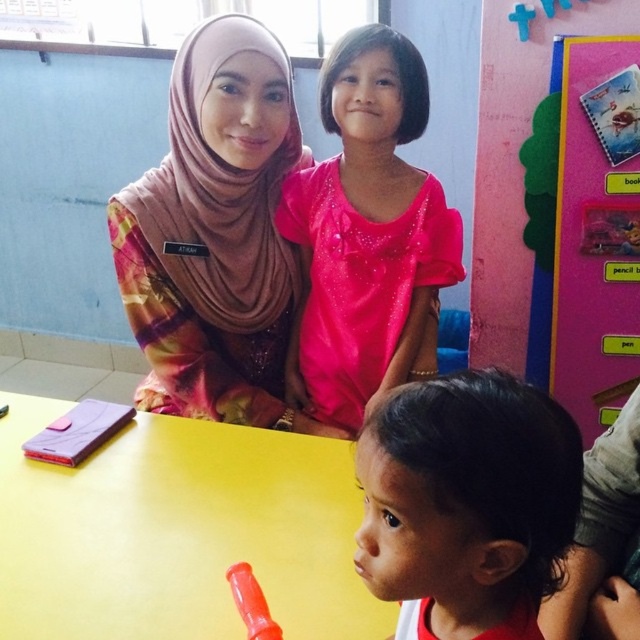
You are a photographer setting up a shot of the scene described. You want to focus on the multicolored fabric hijab at upper left and the dark brown hair at lower right. Which object is closer to your camera?

The multicolored fabric hijab at upper left is closer to the camera than the dark brown hair at lower right.

You are a photographer setting up for a group photo. You want to ensure that both the multicolored fabric hijab at upper left and the child holding the red object are in focus. Given that your camera has a depth of field that can cover 4 feet, will you be able to capture both subjects clearly?

The distance between the multicolored fabric hijab at upper left and the child holding the red object is 4.54 feet. Since the camera can only cover 4 feet, the depth of field is insufficient to keep both in focus simultaneously.

You are a photographer setting up for a group photo in the scene. You need to ensure that the multicolored fabric hijab at upper left is visible in the frame. Where should you position the camera relative to the hijab?

To ensure the multicolored fabric hijab at upper left is visible in the frame, position the camera so it is facing towards the hijab, keeping it within the camera view. The exact coordinates at point (214,232) indicate its location, so centering the camera there would capture it effectively.